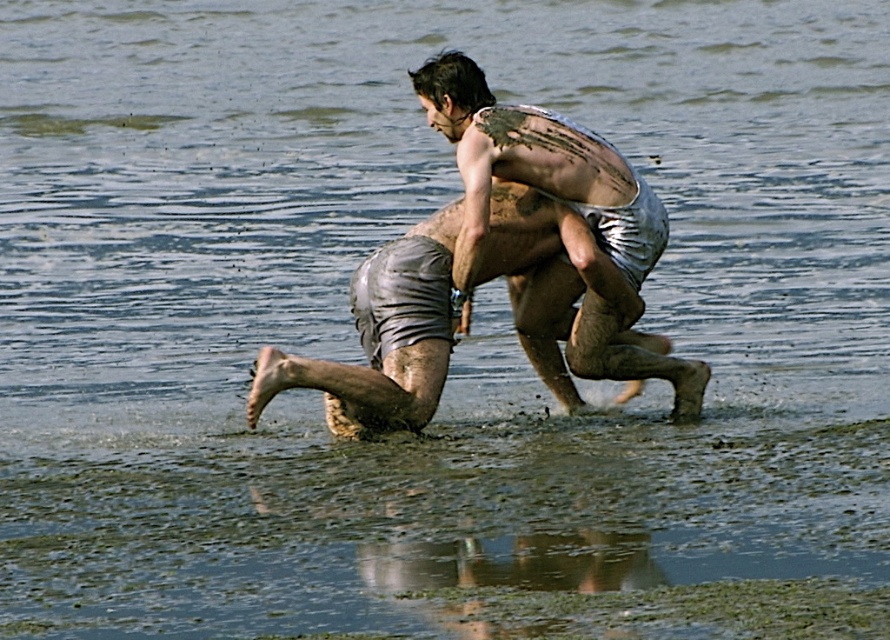
Which of these two, muddy wet ground at lower center or muddy skin torso at center, stands taller?

muddy skin torso at center

Between muddy wet ground at lower center and muddy skin torso at center, which one has less height?

muddy wet ground at lower center

Does point (589, 508) come in front of point (593, 326)?

Yes, point (589, 508) is closer to viewer.

Identify the location of muddy wet ground at lower center. The image size is (890, 640). (427, 522).

Which of these two, muddy skin torso at center or muddy skin at upper center, stands taller?

muddy skin torso at center

From the picture: Between muddy skin torso at center and muddy skin at upper center, which one is positioned lower?

muddy skin torso at center

Does point (613, 152) lie behind point (523, 113)?

Yes, it is.

Locate an element on the screen. The height and width of the screenshot is (640, 890). muddy skin torso at center is located at coordinates (537, 170).

Is muddy wet ground at lower center thinner than muddy skin at upper center?

Incorrect, muddy wet ground at lower center's width is not less than muddy skin at upper center's.

Is muddy wet ground at lower center positioned at the back of muddy skin at upper center?

No, it is in front of muddy skin at upper center.

Is point (750, 454) closer to viewer compared to point (540, 129)?

Yes.

Locate an element on the screen. The width and height of the screenshot is (890, 640). muddy wet ground at lower center is located at coordinates (427, 522).